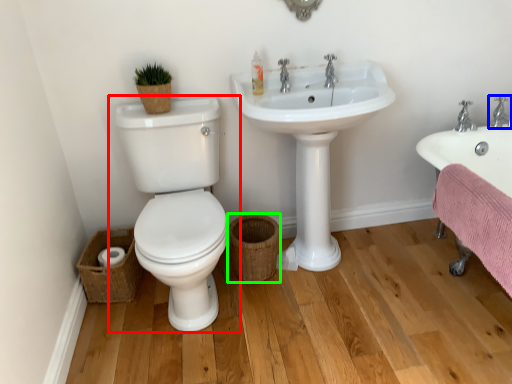
Question: Which object is positioned closest to toilet (highlighted by a red box)? Select from tap (highlighted by a blue box) and basket (highlighted by a green box).

Choices:
 (A) tap
 (B) basket

Answer: (B)